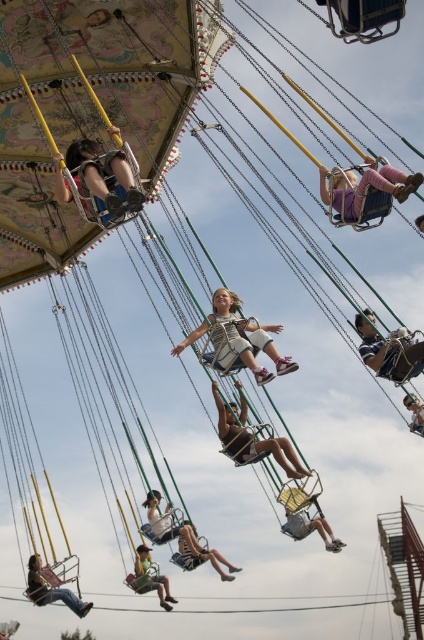
Question: Which of these objects is positioned farthest from the light brown wooden swing at center?

Choices:
 (A) matte blue jeans at center
 (B) metallic silver helmet at center
 (C) denim jeans at lower left

Answer: (C)

Question: Is denim jeans at lower left further to the viewer compared to light brown wooden swing at center?

Choices:
 (A) no
 (B) yes

Answer: (B)

Question: From the image, what is the correct spatial relationship of pink fabric swing at upper center in relation to denim shorts at center?

Choices:
 (A) left
 (B) right

Answer: (B)

Question: Is denim jeans at lower left positioned at the back of green fabric swing at lower left?

Choices:
 (A) yes
 (B) no

Answer: (A)

Question: Which point appears farthest from the camera in this image?

Choices:
 (A) (346, 189)
 (B) (393, 355)

Answer: (B)

Question: Which is nearer to the light blue denim shorts at center?

Choices:
 (A) matte plastic swing at center
 (B) denim shorts at center
 (C) green fabric swing at lower left

Answer: (A)